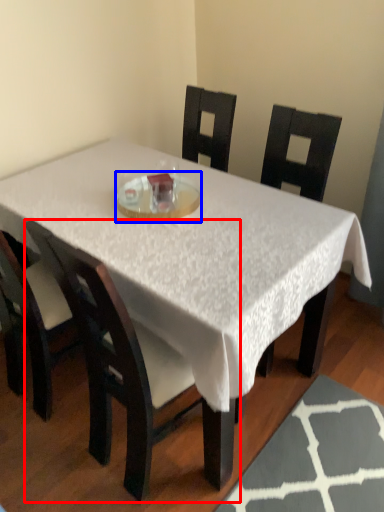
Question: Among these objects, which one is nearest to the camera, chair (highlighted by a red box) or glass plate (highlighted by a blue box)?

Choices:
 (A) chair
 (B) glass plate

Answer: (A)